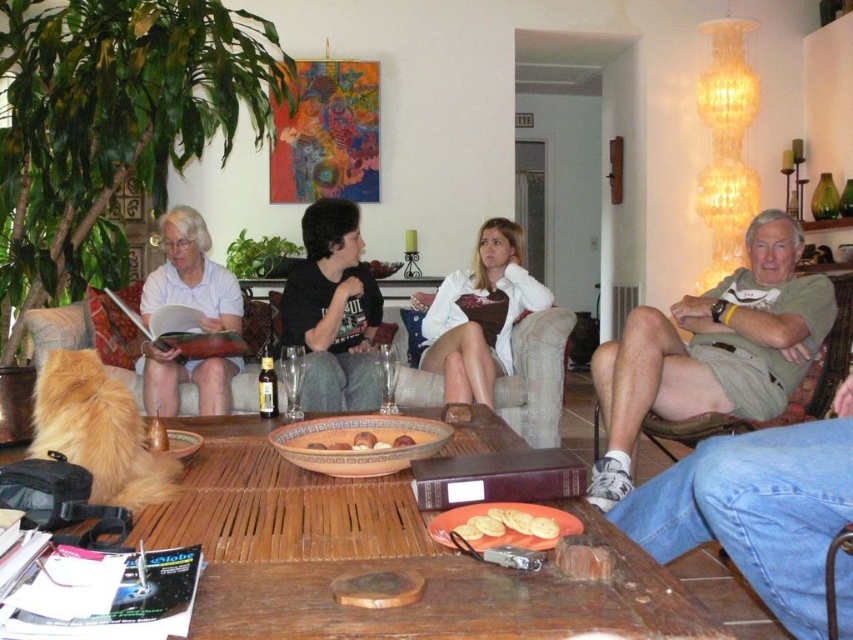
You are a delivery person who needs to place a small package between the khaki cotton shorts at right and the black cotton shirt at center. The package is 1.2 meters long. Will it fit in the space between them?

The khaki cotton shorts at right is 1.19 meters away from the black cotton shirt at center. Since the package is 1.2 meters long, it will not fit in the space between them because the distance is slightly shorter than the package length.

You are a guest in this living room and want to sit down on the couch. You see the khaki cotton shorts at right and the black cotton shirt at center. Which one is higher up?

The khaki cotton shorts at right is much taller than the black cotton shirt at center, so the khaki cotton shorts at right is higher up.